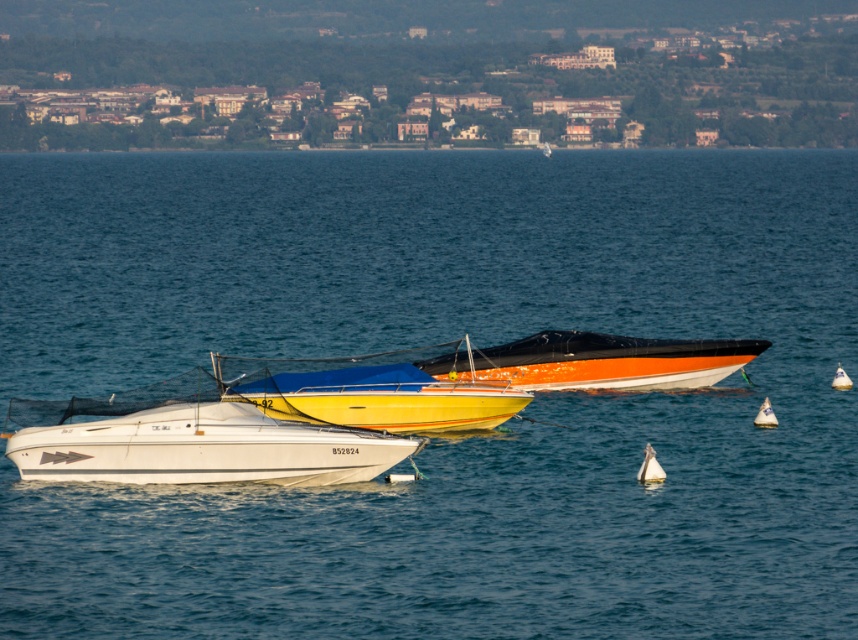
Question: Can you confirm if white glossy boat at center is positioned above orange glossy boat at center?

Choices:
 (A) no
 (B) yes

Answer: (A)

Question: Considering the relative positions of yellow matte boat at center and orange glossy boat at center in the image provided, where is yellow matte boat at center located with respect to orange glossy boat at center?

Choices:
 (A) below
 (B) above

Answer: (A)

Question: Which of the following is the farthest from the observer?

Choices:
 (A) (554, 342)
 (B) (403, 380)

Answer: (A)

Question: Is yellow matte boat at center thinner than orange glossy boat at center?

Choices:
 (A) yes
 (B) no

Answer: (A)

Question: Estimate the real-world distances between objects in this image. Which object is closer to the yellow matte boat at center?

Choices:
 (A) white glossy boat at center
 (B) orange glossy boat at center

Answer: (B)

Question: Which of the following is the farthest from the observer?

Choices:
 (A) yellow matte boat at center
 (B) orange glossy boat at center
 (C) white glossy boat at center

Answer: (B)